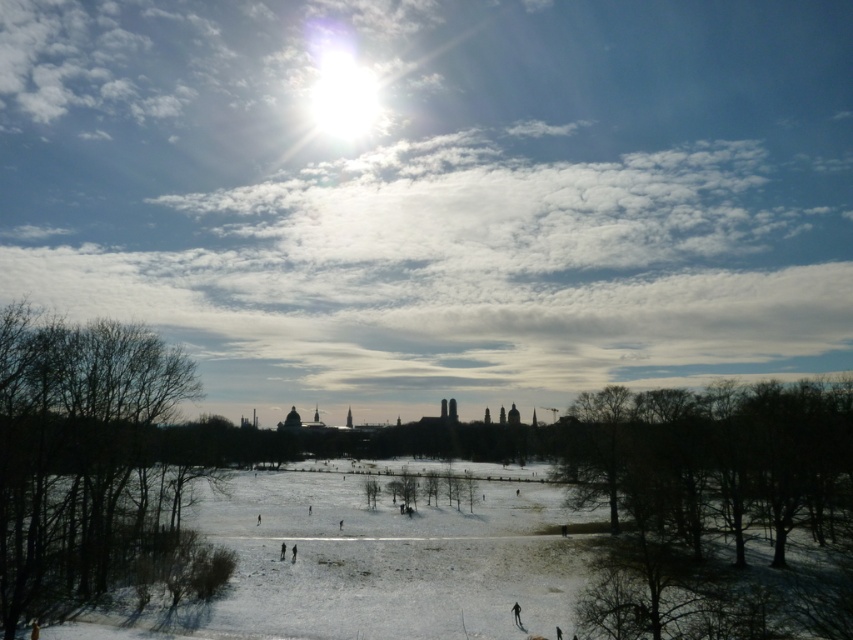
You are standing in the winter landscape and want to walk towards the brown leafless tree at lower right and the bare branches at left. Which object will you reach first?

You will reach the brown leafless tree at lower right first because it is closer to you than the bare branches at left.

Based on the photo, you are an observer looking at the winter landscape. You notice the bright white clouds at upper center and the bare branches at left. Which object is positioned higher in the sky?

The bright white clouds at upper center are positioned higher in the sky than the bare branches at left.

You are an observer looking at the winter landscape. You notice the bright white clouds at upper center and the brown leafless tree at lower right. Which object is closer to you, the observer?

The brown leafless tree at lower right is behind the bright white clouds at upper center, so the bright white clouds at upper center are closer to the observer.